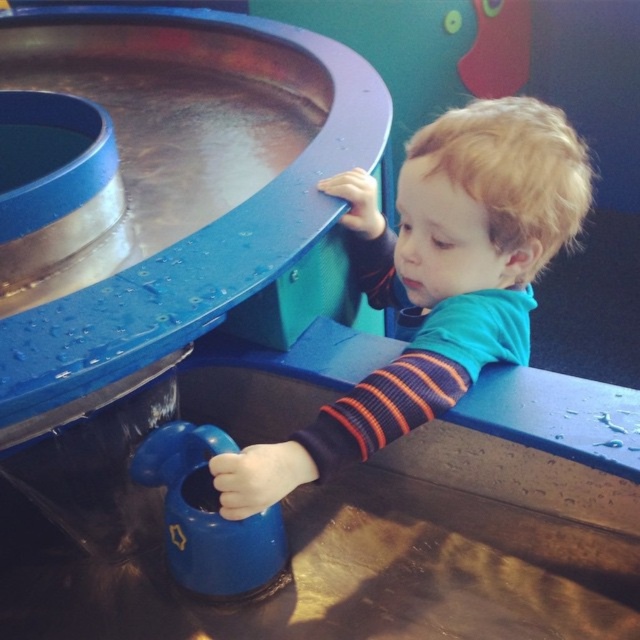
You are a parent trying to hand your child a blue rubber toy at lower center while they are wearing a blue matte shirt at upper right. Can you safely hand it to them without the items getting too close?

The blue matte shirt at upper right and blue rubber toy at lower center are 10.15 inches apart from each other, so there is enough space to hand the blue rubber toy at lower center to the child without the items getting too close.

Where is the blue matte shirt at upper right located in the image?

The blue matte shirt at upper right is located at point (436, 280).